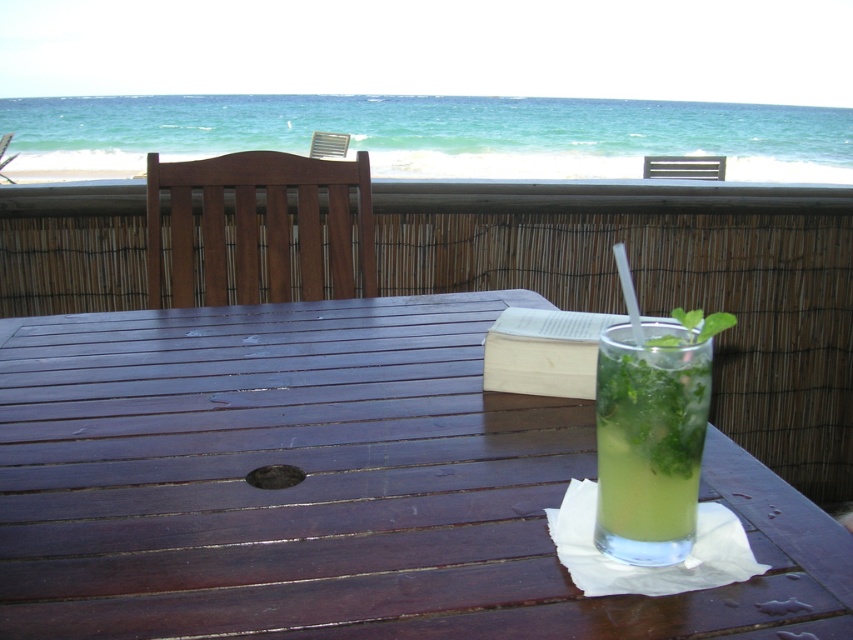
Is wooden table at center shorter than green leafy liquid at center?

No.

Does wooden table at center appear under green leafy liquid at center?

Yes.

Describe the element at coordinates (335, 486) in the screenshot. This screenshot has width=853, height=640. I see `wooden table at center` at that location.

At what (x,y) coordinates should I click in order to perform the action: click on wooden table at center. Please return your answer as a coordinate pair (x, y). This screenshot has width=853, height=640. Looking at the image, I should click on (335, 486).